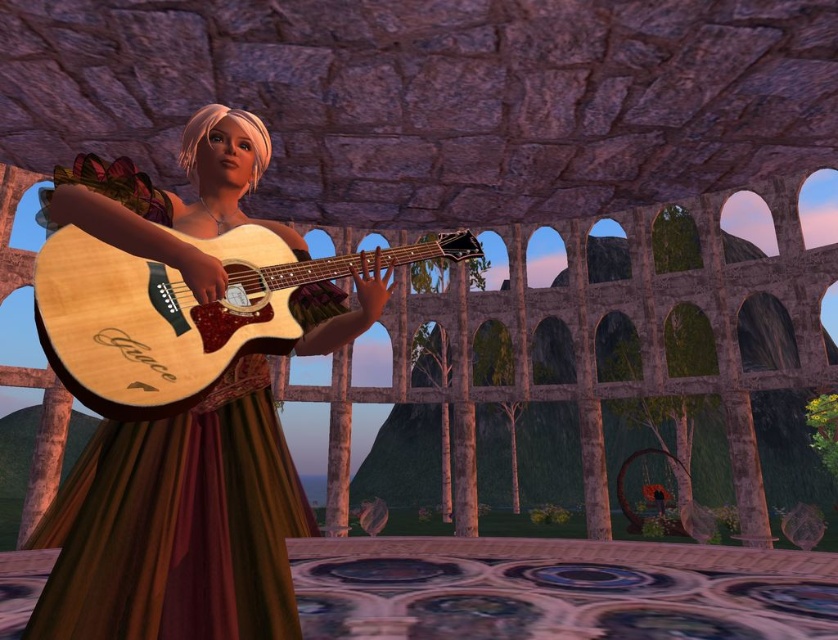
You are a photographer setting up for a shoot in the ancient stone structure. You notice the wooden guitar at center and the natural wood guitar at center. Which guitar should you position closer to the leftmost column to ensure proper framing?

The wooden guitar at center should be positioned closer to the leftmost column because it is already to the left of the natural wood guitar at center, making it naturally aligned with the left side of the scene.

You are a stagehand setting up for a concert. You need to place a microphone stand between the wooden guitar at center and the natural wood guitar at center. Which guitar should the microphone stand be closer to if the stand can only accommodate the smaller guitar?

The microphone stand should be closer to the natural wood guitar at center because it is smaller than the wooden guitar at center.